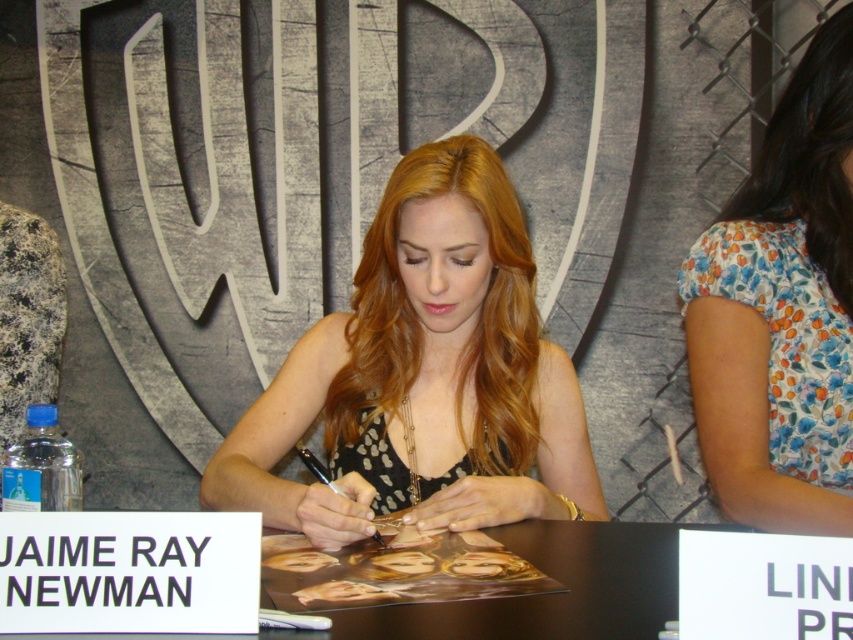
You are a photographer who needs to capture Jaime Ray Newman signing autographs. You have two papers available, a white paper at center and a black paper at center. Which paper should you choose to ensure the autograph is clearly visible against the background?

The white paper at center is bigger than the black paper at center, so the autograph will be more visible on the white paper at center due to its larger size.

You are a photographer taking a picture of the scene. You need to focus on the white paper at center and the black paper at center. Which one should you focus on first to ensure both are in focus?

The white paper at center is closer to the viewer than the black paper at center. To ensure both are in focus, you should focus on the white paper at center first, as it is the closer object.

You are a photographer taking a picture of Jaime Ray Newman signing an autograph. You notice the floral fabric shirt at right and the white paper at center. Which object is closer to the camera?

The floral fabric shirt at right is positioned over the white paper at center, so it is closer to the camera.